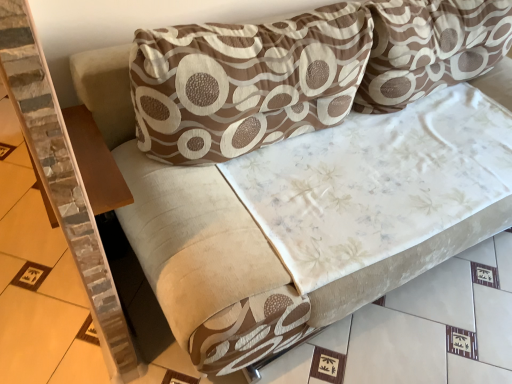
This screenshot has height=384, width=512. What do you see at coordinates (95, 162) in the screenshot? I see `brown wood table at left` at bounding box center [95, 162].

Measure the distance between point (88, 189) and camera.

The distance of point (88, 189) from camera is 1.11 meters.

What do you see at coordinates (245, 82) in the screenshot? I see `brown printed cushion at upper center, positioned as the 1th pillow in left-to-right order` at bounding box center [245, 82].

You are a GUI agent. You are given a task and a screenshot of the screen. Output one action in this format:
    pyautogui.click(x=<x>, y=<y>)
    Task: Click on the brown printed fabric pillow at upper center, the first pillow viewed from the right
    
    Given the screenshot: What is the action you would take?
    pyautogui.click(x=430, y=48)

Consider the image. From the image's perspective, who appears lower, brown printed fabric pillow at upper center, positioned as the second pillow in left-to-right order, or brown printed cushion at upper center, positioned as the 1th pillow in left-to-right order?

brown printed cushion at upper center, positioned as the 1th pillow in left-to-right order.

Is point (506, 27) more distant than point (260, 130)?

Yes, it is behind point (260, 130).

Does brown printed fabric pillow at upper center, the first pillow viewed from the right, have a greater width compared to brown printed cushion at upper center, arranged as the 2th pillow when viewed from the right?

Yes, brown printed fabric pillow at upper center, the first pillow viewed from the right, is wider than brown printed cushion at upper center, arranged as the 2th pillow when viewed from the right.

Is brown printed fabric pillow at upper center, the first pillow viewed from the right, aimed at brown printed cushion at upper center, arranged as the 2th pillow when viewed from the right?

No, brown printed fabric pillow at upper center, the first pillow viewed from the right, is not facing towards brown printed cushion at upper center, arranged as the 2th pillow when viewed from the right.

Based on the photo, is brown wood table at left outside of brown printed cushion at upper center, positioned as the 1th pillow in left-to-right order?

brown wood table at left lies outside brown printed cushion at upper center, positioned as the 1th pillow in left-to-right order,'s area.

Is brown wood table at left taller or shorter than brown printed cushion at upper center, arranged as the 2th pillow when viewed from the right?

In the image, brown wood table at left appears to be shorter than brown printed cushion at upper center, arranged as the 2th pillow when viewed from the right.

Does point (103, 169) appear closer or farther from the camera than point (170, 83)?

Point (103, 169) is positioned farther from the camera compared to point (170, 83).

Which object is positioned more to the left, brown wood table at left or brown printed cushion at upper center, positioned as the 1th pillow in left-to-right order?

brown wood table at left.

Considering the positions of objects brown printed cushion at upper center, arranged as the 2th pillow when viewed from the right, and brown printed fabric pillow at upper center, the first pillow viewed from the right, in the image provided, who is more to the right, brown printed cushion at upper center, arranged as the 2th pillow when viewed from the right, or brown printed fabric pillow at upper center, the first pillow viewed from the right,?

brown printed fabric pillow at upper center, the first pillow viewed from the right, is more to the right.

Based on the photo, in terms of width, does brown printed cushion at upper center, positioned as the 1th pillow in left-to-right order, look wider or thinner when compared to brown printed fabric pillow at upper center, the first pillow viewed from the right?

Considering their sizes, brown printed cushion at upper center, positioned as the 1th pillow in left-to-right order, looks slimmer than brown printed fabric pillow at upper center, the first pillow viewed from the right.

Does brown printed cushion at upper center, positioned as the 1th pillow in left-to-right order, have a greater height compared to brown printed fabric pillow at upper center, the first pillow viewed from the right?

Incorrect, the height of brown printed cushion at upper center, positioned as the 1th pillow in left-to-right order, is not larger of that of brown printed fabric pillow at upper center, the first pillow viewed from the right.

Can you confirm if brown printed cushion at upper center, positioned as the 1th pillow in left-to-right order, is smaller than brown printed fabric pillow at upper center, positioned as the second pillow in left-to-right order?

Correct, brown printed cushion at upper center, positioned as the 1th pillow in left-to-right order, occupies less space than brown printed fabric pillow at upper center, positioned as the second pillow in left-to-right order.

Which of these two, brown printed cushion at upper center, arranged as the 2th pillow when viewed from the right, or brown wood table at left, is bigger?

brown printed cushion at upper center, arranged as the 2th pillow when viewed from the right.

Consider the image. How different are the orientations of brown printed cushion at upper center, arranged as the 2th pillow when viewed from the right, and brown wood table at left in degrees?

There is a 91.1-degree angle between the facing directions of brown printed cushion at upper center, arranged as the 2th pillow when viewed from the right, and brown wood table at left.

Is brown printed cushion at upper center, positioned as the 1th pillow in left-to-right order, positioned beyond the bounds of brown wood table at left?

Yes, brown printed cushion at upper center, positioned as the 1th pillow in left-to-right order, is not within brown wood table at left.

Is brown printed cushion at upper center, arranged as the 2th pillow when viewed from the right, oriented towards brown wood table at left?

No, brown printed cushion at upper center, arranged as the 2th pillow when viewed from the right, is not turned towards brown wood table at left.

Is brown printed fabric pillow at upper center, the first pillow viewed from the right, positioned beyond the bounds of brown wood table at left?

Absolutely, brown printed fabric pillow at upper center, the first pillow viewed from the right, is external to brown wood table at left.

I want to click on table in front of the brown printed fabric pillow at upper center, the first pillow viewed from the right, so click(95, 162).

Is brown printed fabric pillow at upper center, the first pillow viewed from the right, facing towards brown wood table at left?

No, brown printed fabric pillow at upper center, the first pillow viewed from the right, is not oriented towards brown wood table at left.

Considering the points (125, 196) and (384, 107), which point is behind, point (125, 196) or point (384, 107)?

Positioned behind is point (384, 107).

Is brown wood table at left thinner than brown printed fabric pillow at upper center, the first pillow viewed from the right?

Yes.

Is brown wood table at left inside the boundaries of brown printed fabric pillow at upper center, the first pillow viewed from the right, or outside?

brown wood table at left is spatially situated outside brown printed fabric pillow at upper center, the first pillow viewed from the right.

How many degrees apart are the facing directions of brown wood table at left and brown printed fabric pillow at upper center, positioned as the second pillow in left-to-right order?

The facing directions of brown wood table at left and brown printed fabric pillow at upper center, positioned as the second pillow in left-to-right order, are 91.1 degrees apart.

The image size is (512, 384). What are the coordinates of `pillow below the brown printed fabric pillow at upper center, positioned as the second pillow in left-to-right order (from the image's perspective)` in the screenshot? It's located at (245, 82).

Find the location of a particular element. The image size is (512, 384). table behind the brown printed cushion at upper center, positioned as the 1th pillow in left-to-right order is located at coordinates (95, 162).

When comparing their distances from brown wood table at left, does brown printed cushion at upper center, arranged as the 2th pillow when viewed from the right, or brown printed fabric pillow at upper center, positioned as the second pillow in left-to-right order, seem closer?

The object closer to brown wood table at left is brown printed cushion at upper center, arranged as the 2th pillow when viewed from the right.

When comparing their distances from brown printed fabric pillow at upper center, the first pillow viewed from the right, does brown printed cushion at upper center, arranged as the 2th pillow when viewed from the right, or brown wood table at left seem further?

The object further to brown printed fabric pillow at upper center, the first pillow viewed from the right, is brown wood table at left.

Considering their positions, is brown printed fabric pillow at upper center, positioned as the second pillow in left-to-right order, positioned further to brown printed cushion at upper center, positioned as the 1th pillow in left-to-right order, than brown wood table at left?

brown wood table at left is positioned further to the anchor brown printed cushion at upper center, positioned as the 1th pillow in left-to-right order.

Which object lies further to the anchor point brown wood table at left, brown printed fabric pillow at upper center, positioned as the second pillow in left-to-right order, or brown printed cushion at upper center, arranged as the 2th pillow when viewed from the right?

brown printed fabric pillow at upper center, positioned as the second pillow in left-to-right order.

From the image, which object appears to be farther from brown printed cushion at upper center, arranged as the 2th pillow when viewed from the right, brown wood table at left or brown printed fabric pillow at upper center, positioned as the second pillow in left-to-right order?

brown wood table at left lies further to brown printed cushion at upper center, arranged as the 2th pillow when viewed from the right, than the other object.

Considering their positions, is brown wood table at left positioned closer to brown printed fabric pillow at upper center, positioned as the second pillow in left-to-right order, than brown printed cushion at upper center, positioned as the 1th pillow in left-to-right order?

Based on the image, brown printed cushion at upper center, positioned as the 1th pillow in left-to-right order, appears to be nearer to brown printed fabric pillow at upper center, positioned as the second pillow in left-to-right order.

At what (x,y) coordinates should I click in order to perform the action: click on pillow located between brown wood table at left and brown printed fabric pillow at upper center, the first pillow viewed from the right, in the left-right direction. Please return your answer as a coordinate pair (x, y). The height and width of the screenshot is (384, 512). Looking at the image, I should click on (245, 82).